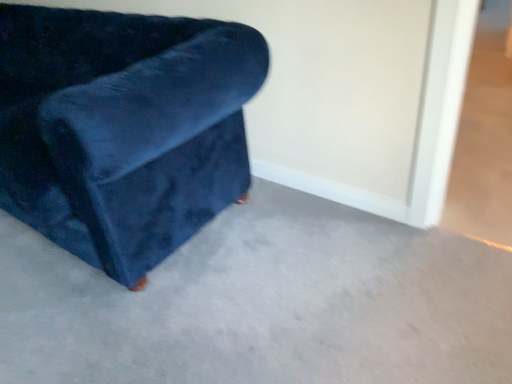
The height and width of the screenshot is (384, 512). What do you see at coordinates (123, 129) in the screenshot?
I see `velvet blue chair at left` at bounding box center [123, 129].

Image resolution: width=512 pixels, height=384 pixels. Identify the location of velvet blue chair at left. (123, 129).

The image size is (512, 384). Find the location of `velvet blue couch at left`. velvet blue couch at left is located at coordinates (264, 304).

What do you see at coordinates (264, 304) in the screenshot?
I see `velvet blue couch at left` at bounding box center [264, 304].

In order to click on velvet blue chair at left in this screenshot , I will do `click(123, 129)`.

Which is more to the right, velvet blue couch at left or velvet blue chair at left?

velvet blue couch at left.

Is velvet blue couch at left in front of velvet blue chair at left?

Yes, it is in front of velvet blue chair at left.

Does point (497, 295) come farther from viewer compared to point (31, 225)?

That is False.

From the image's perspective, which object appears higher, velvet blue couch at left or velvet blue chair at left?

velvet blue chair at left is shown above in the image.

From a real-world perspective, is velvet blue couch at left physically located above or below velvet blue chair at left?

Clearly, from a real-world perspective, velvet blue couch at left is below velvet blue chair at left.

Considering the sizes of objects velvet blue couch at left and velvet blue chair at left in the image provided, who is thinner, velvet blue couch at left or velvet blue chair at left?

velvet blue chair at left is thinner.

Does velvet blue couch at left have a lesser height compared to velvet blue chair at left?

Yes, velvet blue couch at left is shorter than velvet blue chair at left.

Who is bigger, velvet blue couch at left or velvet blue chair at left?

velvet blue chair at left is bigger.

Can we say velvet blue couch at left lies outside velvet blue chair at left?

Indeed, velvet blue couch at left is completely outside velvet blue chair at left.

Is velvet blue couch at left beside velvet blue chair at left?

No, velvet blue couch at left is not beside velvet blue chair at left.

Could you tell me if velvet blue couch at left is facing velvet blue chair at left?

No, velvet blue couch at left is not turned towards velvet blue chair at left.

The width and height of the screenshot is (512, 384). I want to click on chair lying behind the velvet blue couch at left, so click(x=123, y=129).

Can you confirm if velvet blue chair at left is positioned to the left of velvet blue couch at left?

Yes, velvet blue chair at left is to the left of velvet blue couch at left.

Is velvet blue chair at left behind velvet blue couch at left?

Yes, it is.

Which point is more distant from viewer, (x=203, y=127) or (x=199, y=308)?

The point (x=199, y=308) is farther from the camera.

From the image's perspective, is velvet blue chair at left beneath velvet blue couch at left?

No, from the image's perspective, velvet blue chair at left is not below velvet blue couch at left.

From a real-world perspective, is velvet blue chair at left located beneath velvet blue couch at left?

No, from a real-world perspective, velvet blue chair at left is not beneath velvet blue couch at left.

Can you confirm if velvet blue chair at left is wider than velvet blue couch at left?

No.

Considering the sizes of objects velvet blue chair at left and velvet blue couch at left in the image provided, who is taller, velvet blue chair at left or velvet blue couch at left?

velvet blue chair at left.

Consider the image. Considering the sizes of objects velvet blue chair at left and velvet blue couch at left in the image provided, who is bigger, velvet blue chair at left or velvet blue couch at left?

With larger size is velvet blue chair at left.

Would you say velvet blue chair at left contains velvet blue couch at left?

Definitely not — velvet blue couch at left is not inside velvet blue chair at left.

Is velvet blue chair at left far from velvet blue couch at left?

They are positioned close to each other.

Is velvet blue chair at left oriented towards velvet blue couch at left?

No.

What's the angular difference between velvet blue chair at left and velvet blue couch at left's facing directions?

The angular difference between velvet blue chair at left and velvet blue couch at left is 180 degrees.

Measure the distance between velvet blue chair at left and velvet blue couch at left.

A distance of 51.93 centimeters exists between velvet blue chair at left and velvet blue couch at left.

Locate an element on the screen. Image resolution: width=512 pixels, height=384 pixels. chair above the velvet blue couch at left (from the image's perspective) is located at coordinates (123, 129).

Identify the location of concrete that is below the velvet blue chair at left (from the image's perspective). The image size is (512, 384). (264, 304).

Identify the location of concrete below the velvet blue chair at left (from a real-world perspective). (264, 304).